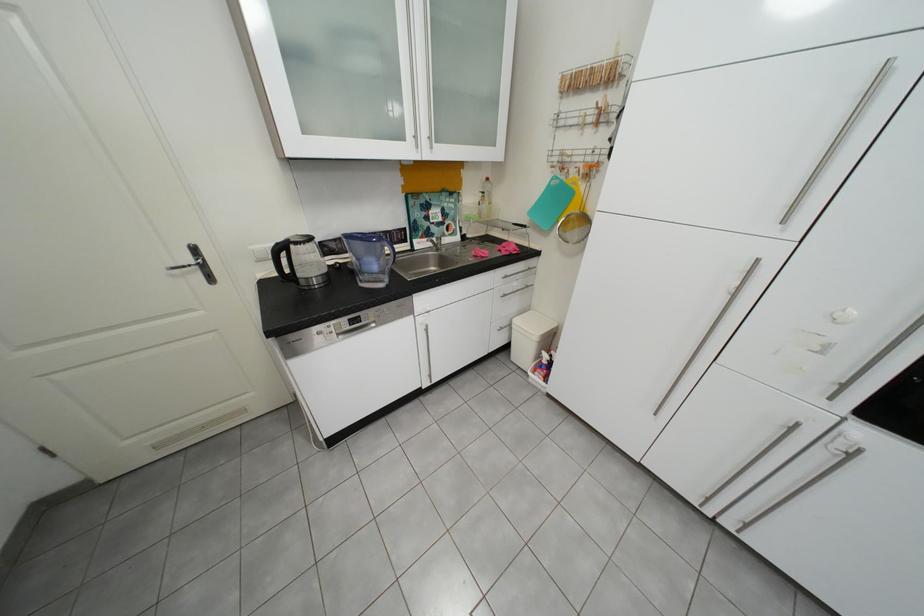
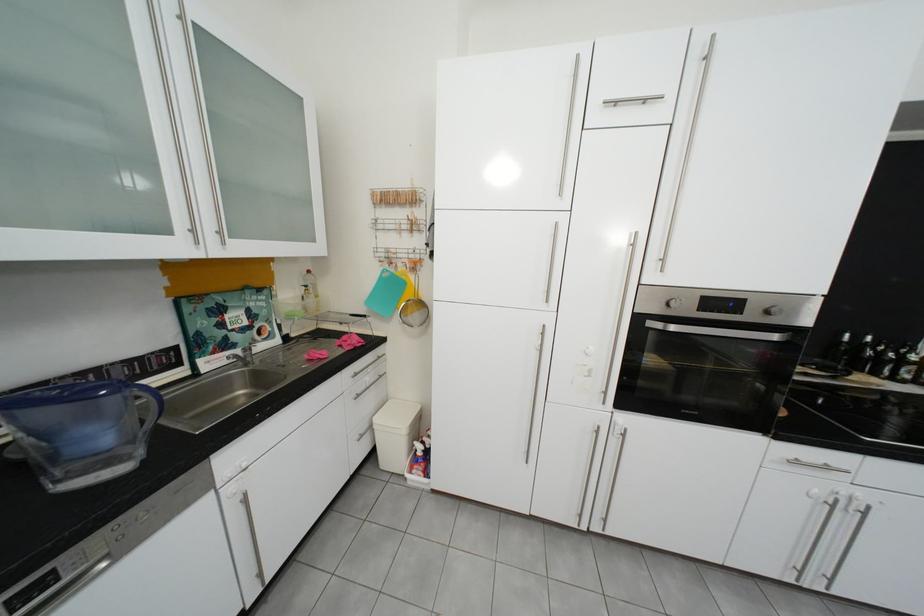
The point at (581, 154) is marked in the first image. Where is the corresponding point in the second image?

(406, 252)